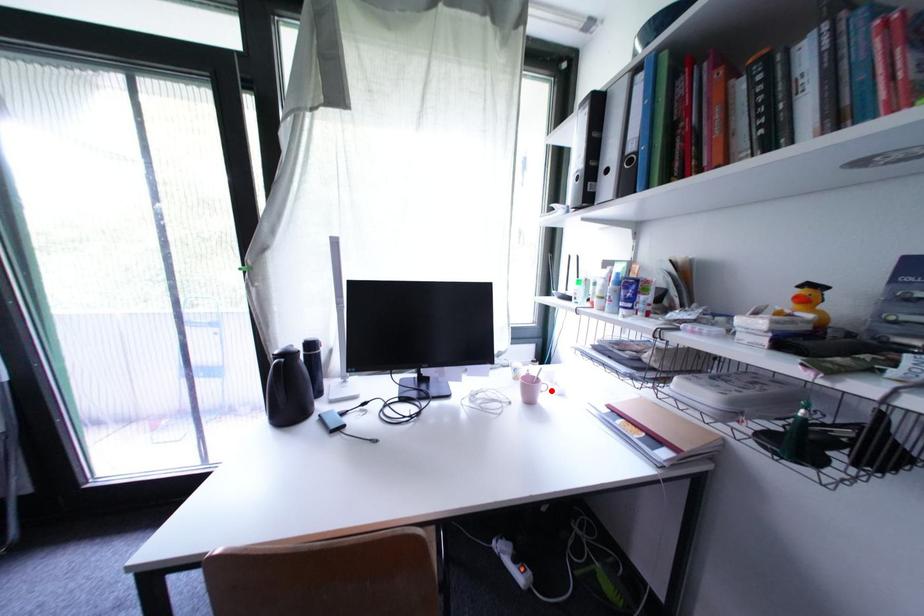
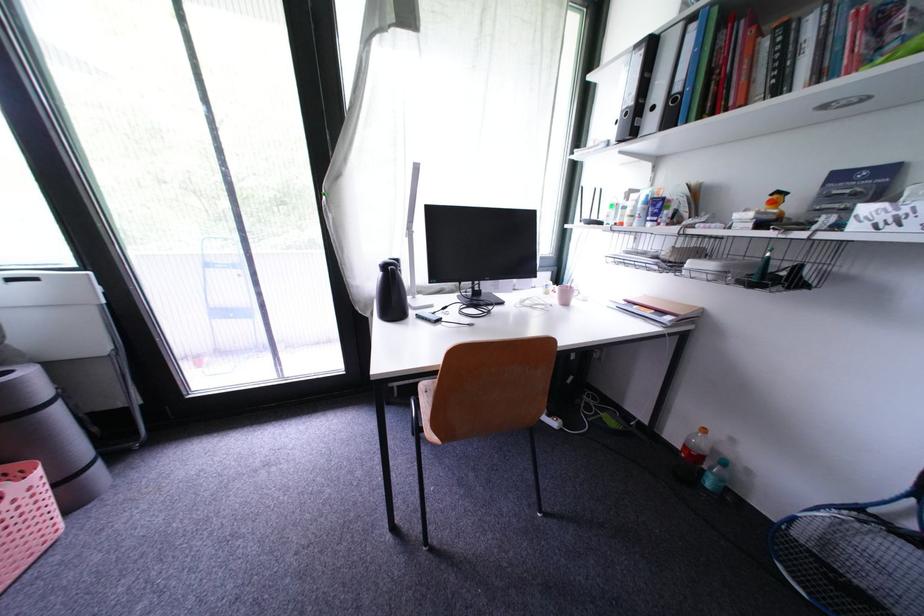
Where in the second image is the point corresponding to the highlighted location from the first image?

(584, 296)